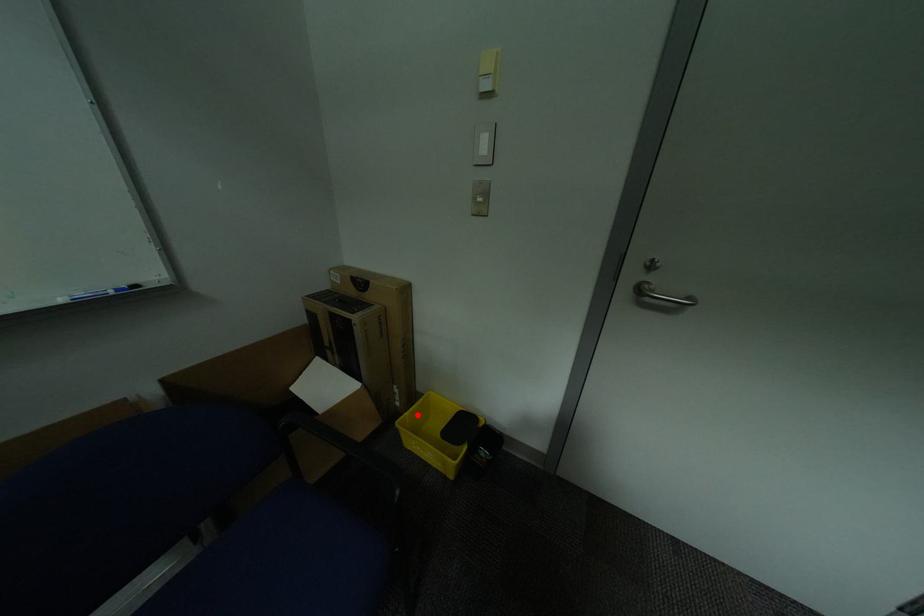
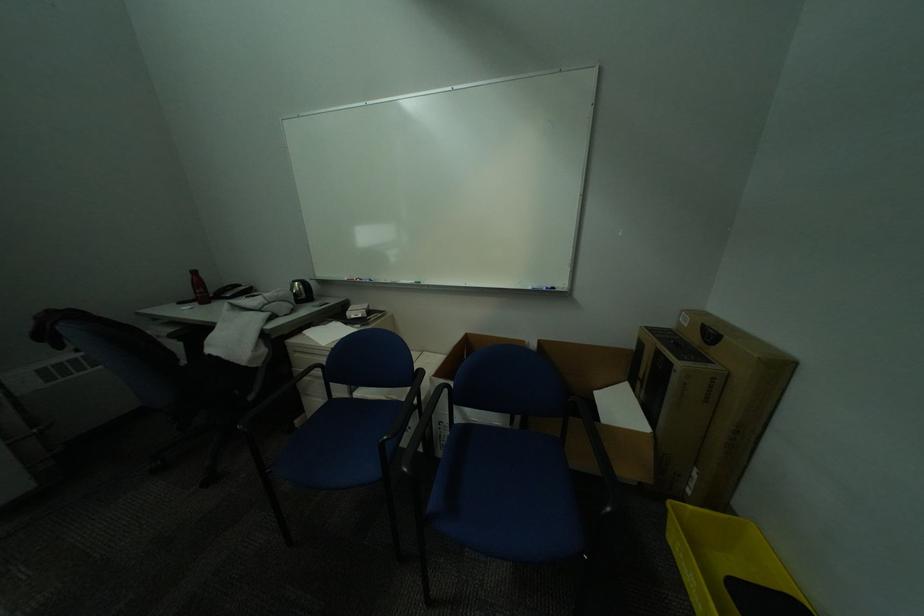
Question: A red point is marked in image1. In image2, is the corresponding 3D point closer to the camera or farther? Reply with the corresponding letter.

Choices:
 (A) The corresponding 3D point is closer.
 (B) The corresponding 3D point is farther.

Answer: (A)